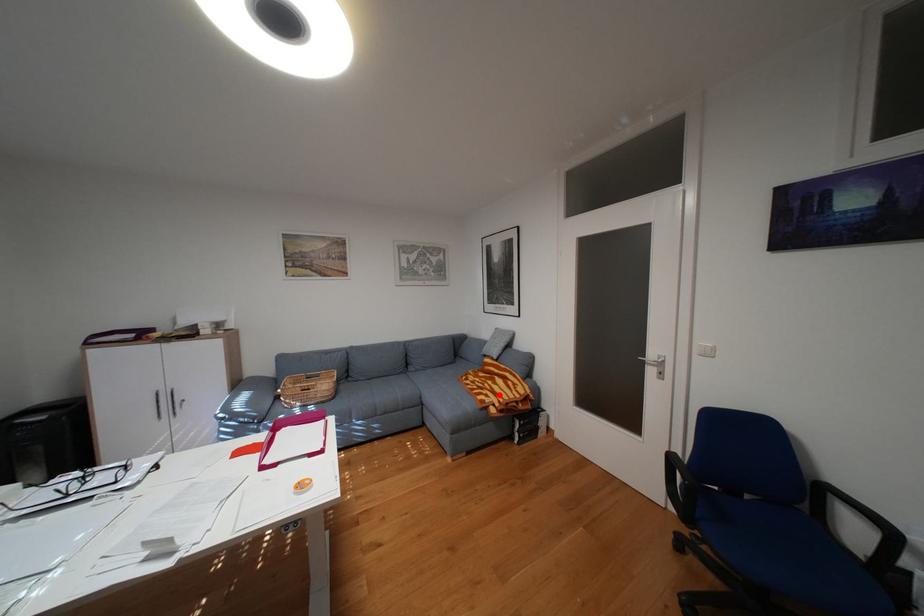
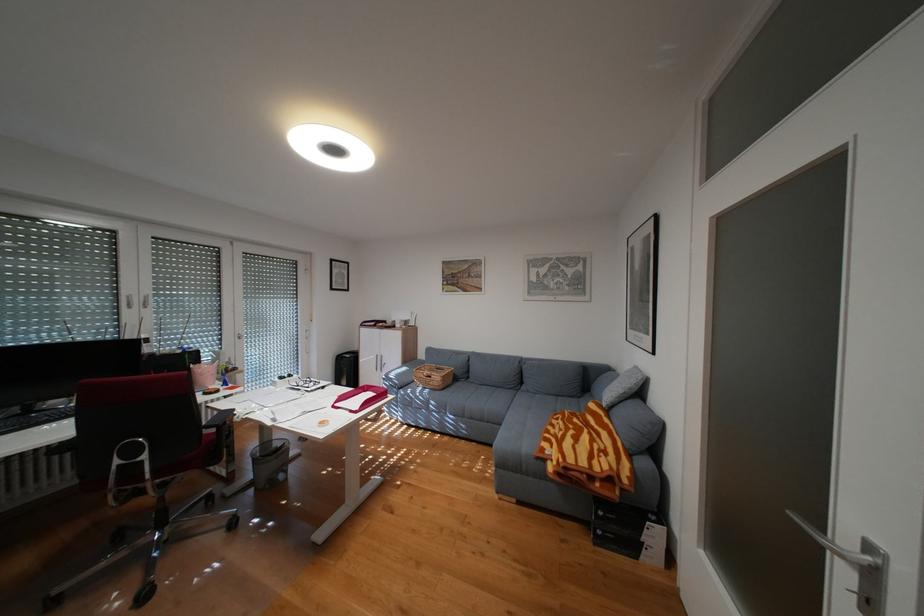
In the second image, find the point that corresponds to the highlighted location in the first image.

(564, 445)